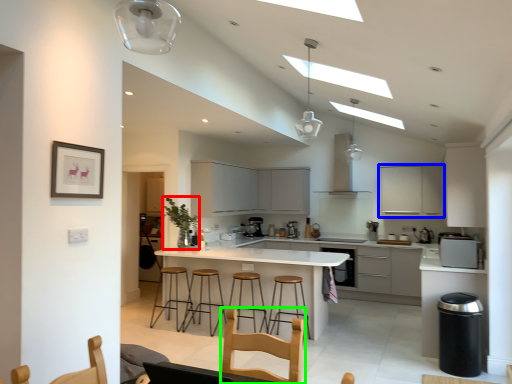
Question: Estimate the real-world distances between objects in this image. Which object is closer to plant (highlighted by a red box), cabinetry (highlighted by a blue box) or swivel chair (highlighted by a green box)?

Choices:
 (A) cabinetry
 (B) swivel chair

Answer: (B)